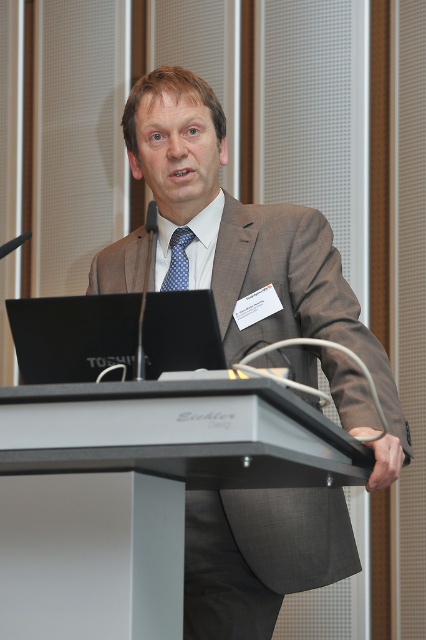
You are an attendee sitting in the front row of the presentation. You need to hand the speaker a note. Which object, the metallic gray podium at center or the black glossy laptop at center, is closer to you to place the note?

The metallic gray podium at center is closer to you than the black glossy laptop at center, so you should place the note on the metallic gray podium at center.

You are an event organizer who needs to adjust the microphone height on the podium. The microphone is currently at the same height as the blue silk tie at center. To ensure the speaker can speak clearly without leaning forward, should you raise or lower the microphone so it aligns with the metallic gray podium at center?

The metallic gray podium at center is positioned under the blue silk tie at center, so the microphone should be lowered to align with the podium to ensure the speaker can speak clearly without leaning forward.

You are organizing a small event and need to place a 1.2 meter wide banner between the metallic gray podium at center and the blue silk tie at center. Can you fit the banner in the space between them?

The metallic gray podium at center might be wider than blue silk tie at center, but without knowing the exact width of the podium and the distance between them, it is uncertain if the 1.2 meter wide banner can fit. Additional measurements are needed to confirm.